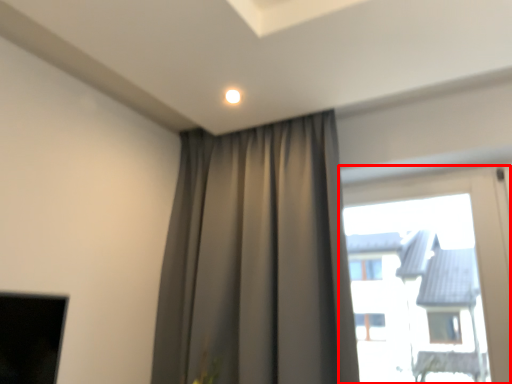
Question: Considering the relative positions of window (annotated by the red box) and curtain in the image provided, where is window (annotated by the red box) located with respect to the staircase?

Choices:
 (A) left
 (B) right

Answer: (B)